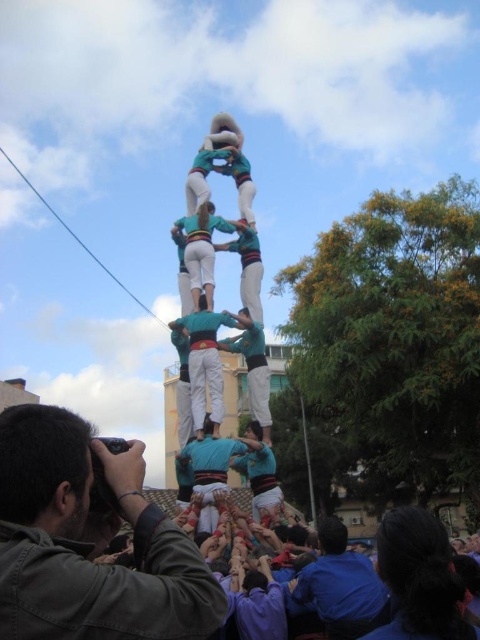
Is point (352, 580) positioned before point (217, 481)?

Yes, point (352, 580) is in front of point (217, 481).

Who is more forward, [300,588] or [216,476]?

Positioned in front is point [300,588].

Locate an element on the screen. Image resolution: width=480 pixels, height=640 pixels. blue cotton shirt at lower right is located at coordinates (340, 586).

Between dark green fabric camera at lower left and blue cotton shirt at lower right, which one is positioned higher?

dark green fabric camera at lower left is above.

Does dark green fabric camera at lower left come in front of blue cotton shirt at lower right?

That is True.

Identify the location of dark green fabric camera at lower left. The width and height of the screenshot is (480, 640). (86, 545).

Locate an element on the screen. This screenshot has height=640, width=480. dark green fabric camera at lower left is located at coordinates (86, 545).

Is dark green fabric camera at lower left closer to camera compared to blue fabric human at center?

Yes, it is in front of blue fabric human at center.

Is point (166, 595) positioned before point (199, 456)?

Yes, it is.

Between point (57, 456) and point (217, 484), which one is positioned in front?

Positioned in front is point (57, 456).

The image size is (480, 640). In order to click on dark green fabric camera at lower left in this screenshot , I will do `click(86, 545)`.